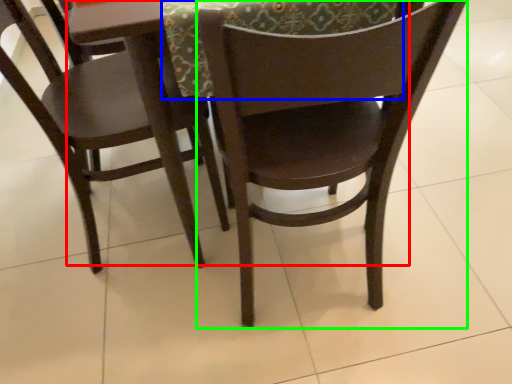
Question: Which is farther away from round table (highlighted by a red box)? tablecloth (highlighted by a blue box) or chair (highlighted by a green box)?

Choices:
 (A) tablecloth
 (B) chair

Answer: (B)